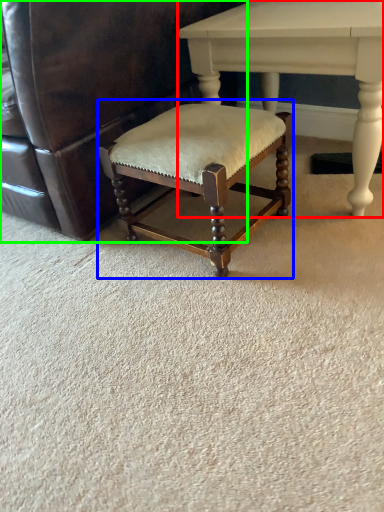
Question: Which object is the farthest from table (highlighted by a red box)? Choose among these: bar stool (highlighted by a blue box) or chair (highlighted by a green box).

Choices:
 (A) bar stool
 (B) chair

Answer: (B)